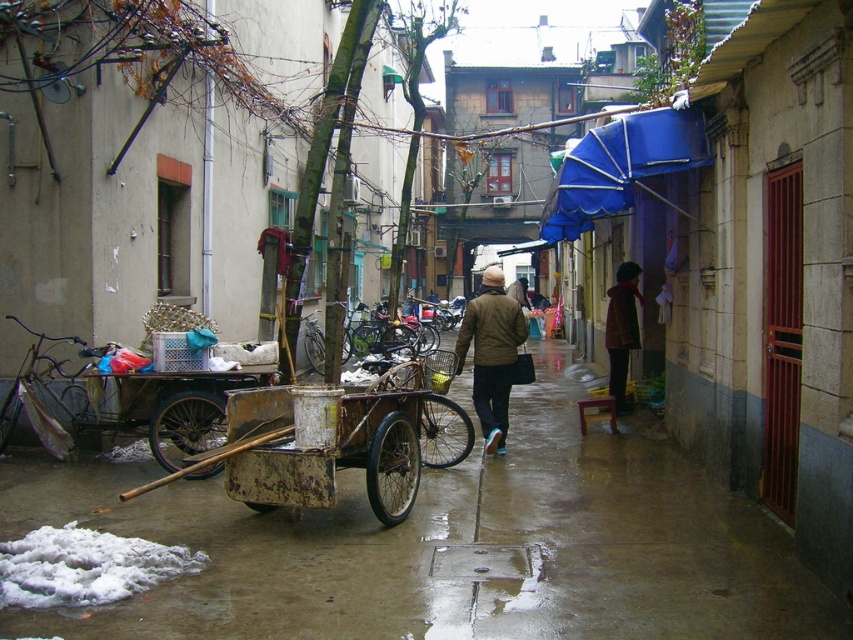
You are a delivery person needing to carry a large package. You see a brown matte jacket at center and a brown woolen coat at right. Which item can you use to wrap the package without needing to fold it multiple times?

The brown matte jacket at center has a larger size compared to brown woolen coat at right, so it can wrap the package without needing to fold it multiple times.

You are a delivery person with a package that needs to be placed between the rusty metal cart at center and the blue fabric umbrella at upper center. The package requires a space of 3 meters. Is there enough space between them?

The rusty metal cart at center is 3.52 meters away from the blue fabric umbrella at upper center, so yes, the package can be placed between them as the distance is sufficient.

You are a delivery person trying to navigate through the narrow alleyway. There is a rusty metal cart at center blocking your path. Can you safely maneuver around it without hitting any obstacles?

The rusty metal cart at center is located at point (339, 460). Since the alley is narrow and the cart is centrally positioned, it might be challenging to maneuver around it safely. Consider checking for alternative pathways or moving the cart if possible.